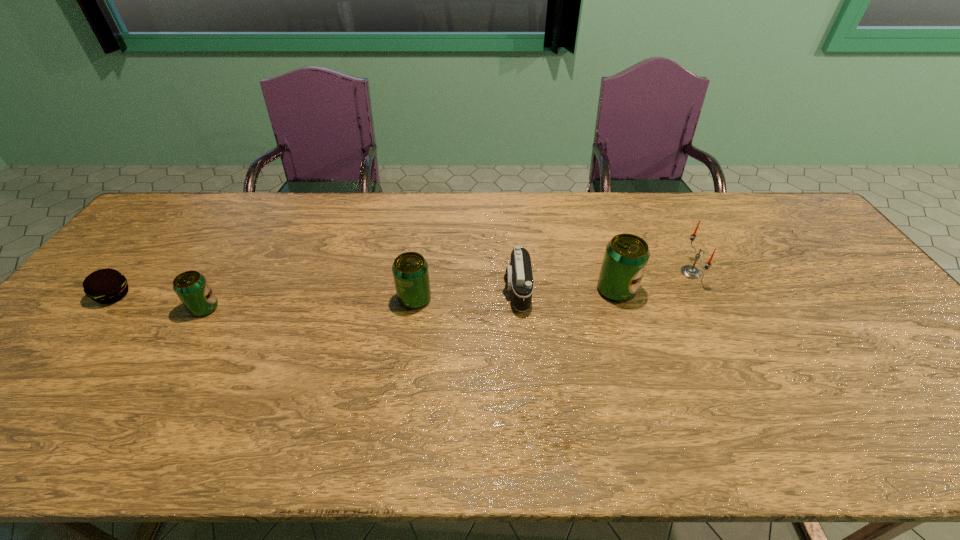
Considering the uniform spacing of beer cans, where should an additional beer can be positioned on the right? Please locate a free spot. Please provide its 2D coordinates. Your answer should be formatted as a tuple, i.e. [(x, y)], where the tuple contains the x and y coordinates of a point satisfying the conditions above.

[(810, 282)]